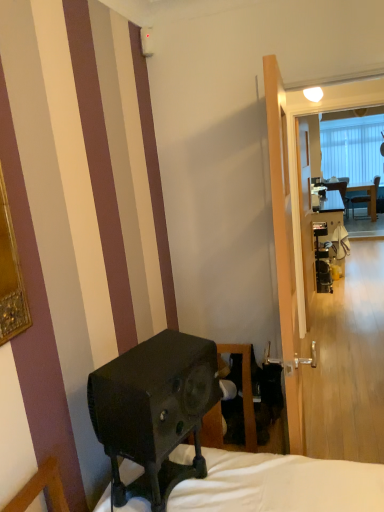
Question: Is the position of matte black desk at center more distant than that of transparent glass screen door at center, positioned as the second screen door in back-to-front order?

Choices:
 (A) no
 (B) yes

Answer: (B)

Question: Is matte black desk at center facing away from transparent glass screen door at center, positioned as the second screen door in back-to-front order?

Choices:
 (A) no
 (B) yes

Answer: (A)

Question: Is matte black desk at center outside transparent glass screen door at center, the second screen door in the right-to-left sequence?

Choices:
 (A) yes
 (B) no

Answer: (A)

Question: From a real-world perspective, is matte black desk at center physically above transparent glass screen door at center, positioned as the second screen door in back-to-front order?

Choices:
 (A) yes
 (B) no

Answer: (B)

Question: From the image's perspective, would you say matte black desk at center is positioned over transparent glass screen door at center, which is the first screen door from front to back?

Choices:
 (A) yes
 (B) no

Answer: (A)

Question: Is matte black desk at center at the right side of transparent glass screen door at center, positioned as the second screen door in back-to-front order?

Choices:
 (A) no
 (B) yes

Answer: (B)

Question: Can you confirm if matte black desk at center is bigger than clear glass screen door at center, positioned as the 2th screen door in front-to-back order?

Choices:
 (A) no
 (B) yes

Answer: (B)

Question: Considering the relative positions of matte black desk at center and clear glass screen door at center, which appears as the first screen door when viewed from the back, in the image provided, is matte black desk at center to the right of clear glass screen door at center, which appears as the first screen door when viewed from the back, from the viewer's perspective?

Choices:
 (A) no
 (B) yes

Answer: (B)

Question: Is matte black desk at center closer to the viewer compared to clear glass screen door at center, positioned as the 2th screen door in front-to-back order?

Choices:
 (A) yes
 (B) no

Answer: (B)

Question: From a real-world perspective, is matte black desk at center on top of clear glass screen door at center, which ranks as the 2th screen door in left-to-right order?

Choices:
 (A) no
 (B) yes

Answer: (A)

Question: From the image's perspective, does matte black desk at center appear lower than clear glass screen door at center, which ranks as the 2th screen door in left-to-right order?

Choices:
 (A) yes
 (B) no

Answer: (A)

Question: Does matte black desk at center have a greater width compared to clear glass screen door at center, positioned as the 2th screen door in front-to-back order?

Choices:
 (A) yes
 (B) no

Answer: (A)

Question: From the image's perspective, is transparent glass screen door at center, the second screen door in the right-to-left sequence, on top of clear glass screen door at center, positioned as the 2th screen door in front-to-back order?

Choices:
 (A) yes
 (B) no

Answer: (B)